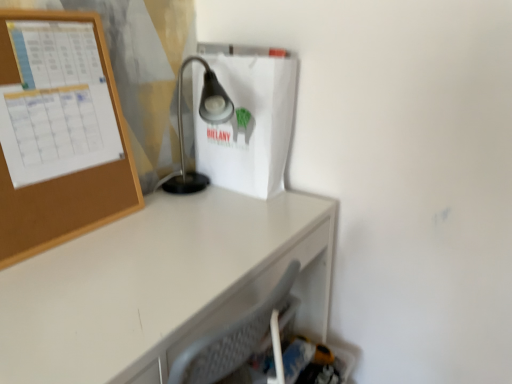
Question: Can you confirm if satin black lamp at center is thinner than white matte paper bag at center?

Choices:
 (A) yes
 (B) no

Answer: (B)

Question: From the image's perspective, is satin black lamp at center on white matte paper bag at center?

Choices:
 (A) no
 (B) yes

Answer: (A)

Question: Does satin black lamp at center contain white matte paper bag at center?

Choices:
 (A) no
 (B) yes

Answer: (A)

Question: Is satin black lamp at center facing towards white matte paper bag at center?

Choices:
 (A) yes
 (B) no

Answer: (B)

Question: Does satin black lamp at center lie in front of white matte paper bag at center?

Choices:
 (A) no
 (B) yes

Answer: (B)

Question: Can you confirm if satin black lamp at center is positioned to the right of white matte paper bag at center?

Choices:
 (A) no
 (B) yes

Answer: (A)

Question: From the image's perspective, would you say satin black lamp at center is positioned over white glossy desk at center?

Choices:
 (A) yes
 (B) no

Answer: (A)

Question: From a real-world perspective, does satin black lamp at center sit lower than white glossy desk at center?

Choices:
 (A) yes
 (B) no

Answer: (B)

Question: Does satin black lamp at center lie behind white glossy desk at center?

Choices:
 (A) no
 (B) yes

Answer: (B)

Question: Can you confirm if satin black lamp at center is positioned to the left of white glossy desk at center?

Choices:
 (A) no
 (B) yes

Answer: (A)

Question: Could you tell me if satin black lamp at center is turned towards white glossy desk at center?

Choices:
 (A) no
 (B) yes

Answer: (A)

Question: Would you say white glossy desk at center is part of satin black lamp at center's contents?

Choices:
 (A) no
 (B) yes

Answer: (A)

Question: Is the depth of white glossy desk at center less than that of satin black lamp at center?

Choices:
 (A) no
 (B) yes

Answer: (B)